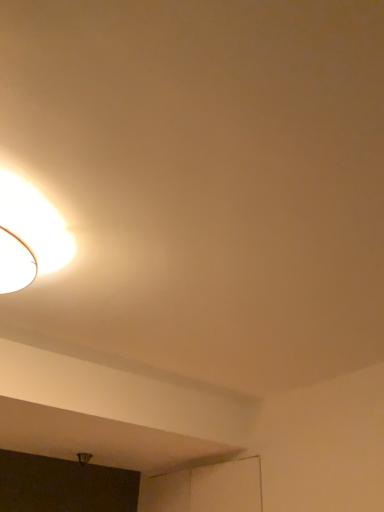
The image size is (384, 512). Identify the location of matte white lampshade at upper left. (29, 234).

The height and width of the screenshot is (512, 384). Describe the element at coordinates (29, 234) in the screenshot. I see `matte white lampshade at upper left` at that location.

Where is `matte white lampshade at upper left`? The width and height of the screenshot is (384, 512). matte white lampshade at upper left is located at coordinates (29, 234).